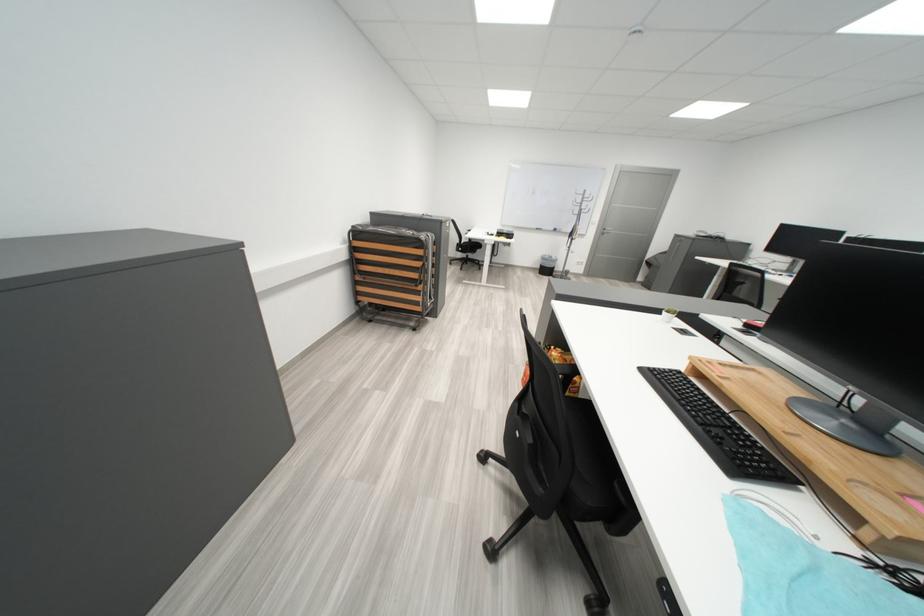
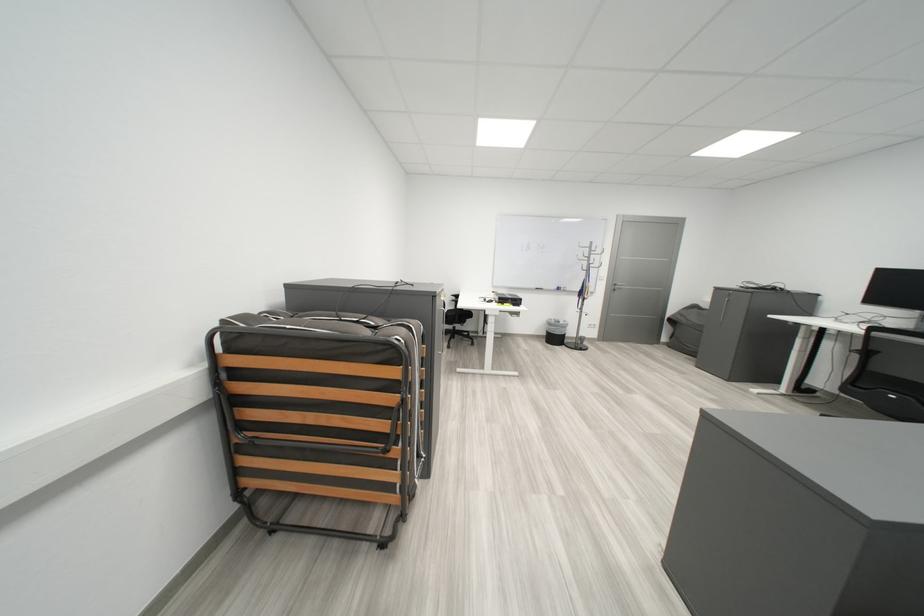
Locate, in the second image, the point that corresponds to point (556, 261) in the first image.

(563, 326)